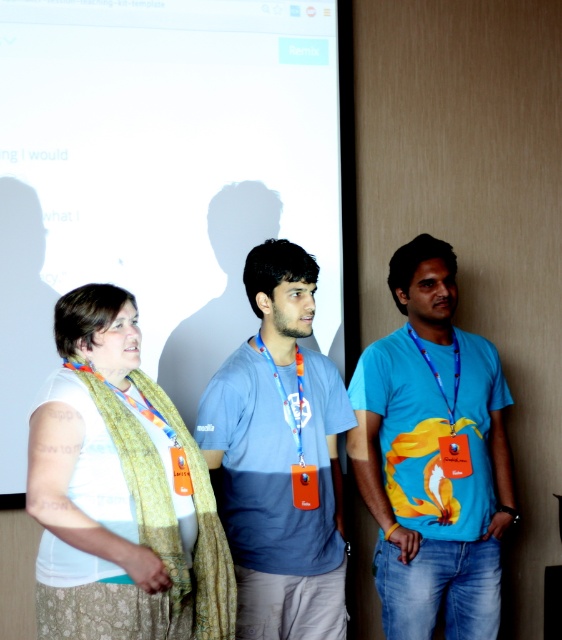
Question: Which of the following is the farthest from the observer?

Choices:
 (A) white matte projection screen at upper left
 (B) white fabric scarf at center
 (C) blue cotton t-shirt at center
 (D) blue printed t-shirt at center

Answer: (A)

Question: Does blue printed t-shirt at center have a smaller size compared to white fabric scarf at center?

Choices:
 (A) yes
 (B) no

Answer: (B)

Question: Is white matte projection screen at upper left below blue cotton t-shirt at center?

Choices:
 (A) no
 (B) yes

Answer: (A)

Question: Which point is farther to the camera?

Choices:
 (A) (79, 369)
 (B) (277, 196)

Answer: (B)

Question: Is blue cotton t-shirt at center positioned in front of white fabric scarf at center?

Choices:
 (A) no
 (B) yes

Answer: (A)

Question: Which point appears closest to the camera in this image?

Choices:
 (A) (424, 493)
 (B) (105, 179)
 (C) (233, 362)
 (D) (142, 467)

Answer: (D)